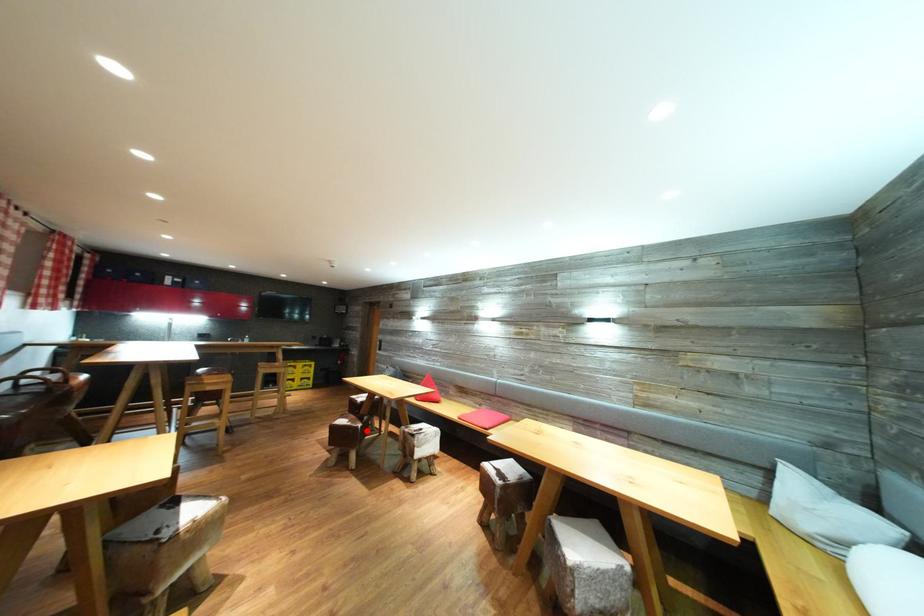
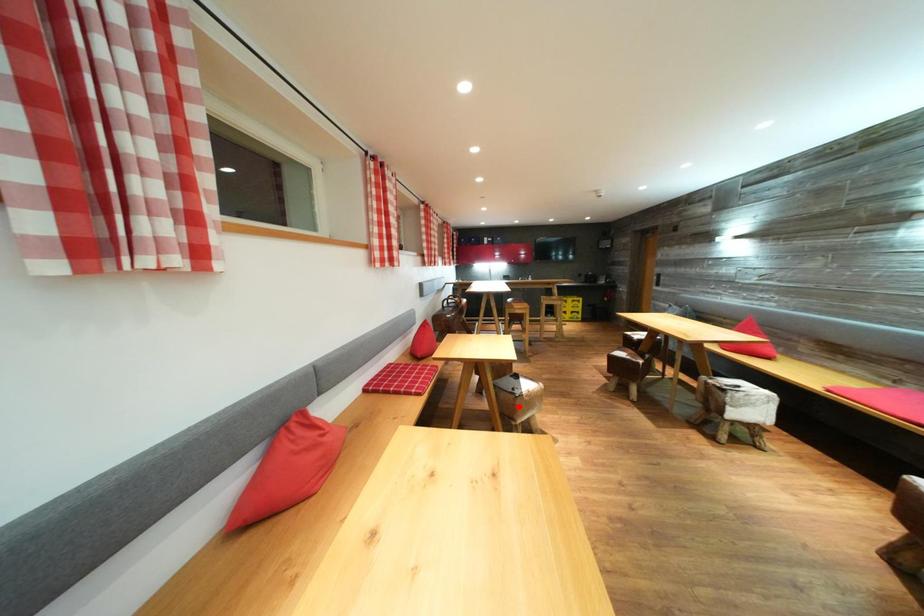
I am providing you with two images of the same scene from different viewpoints. A red point is marked on the first image and another point is marked on the second image. Are the points marked in image1 and image2 representing the same 3D position?

No